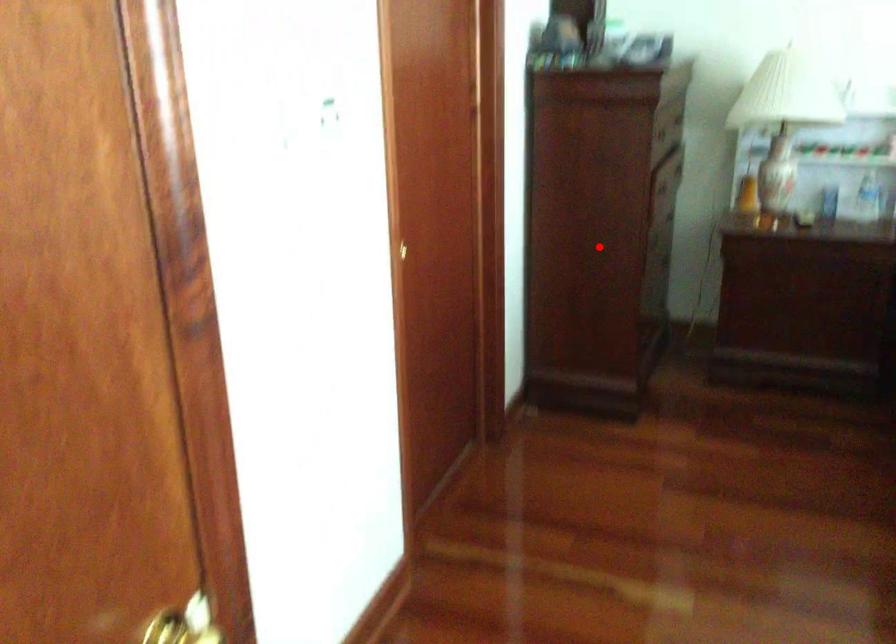
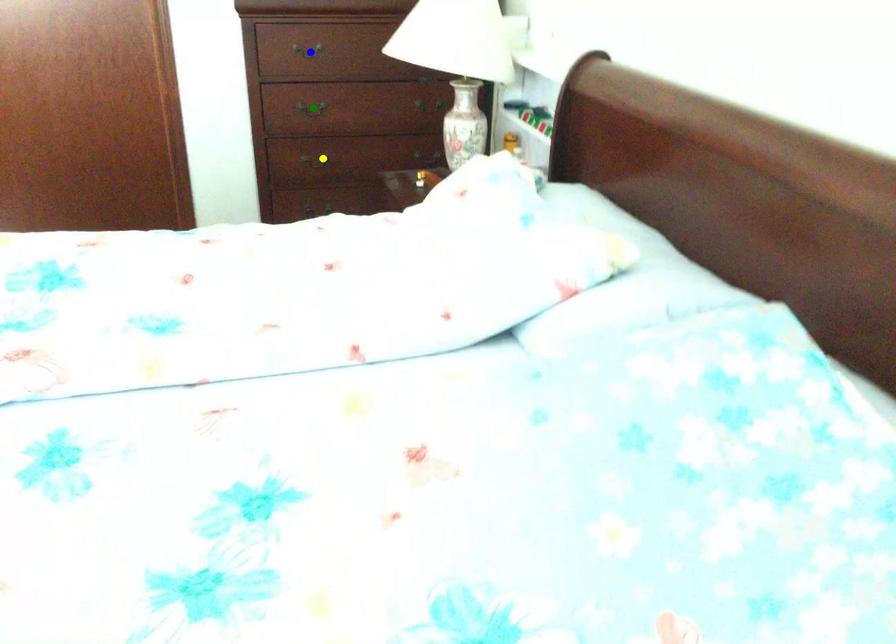
Question: I am providing you with two images of the same scene from different viewpoints. A red point is marked on the first image. You are given multiple points on the second image. In image 2, which mark is for the same physical point as the one in image 1?

Choices:
 (A) green point
 (B) blue point
 (C) yellow point

Answer: (C)